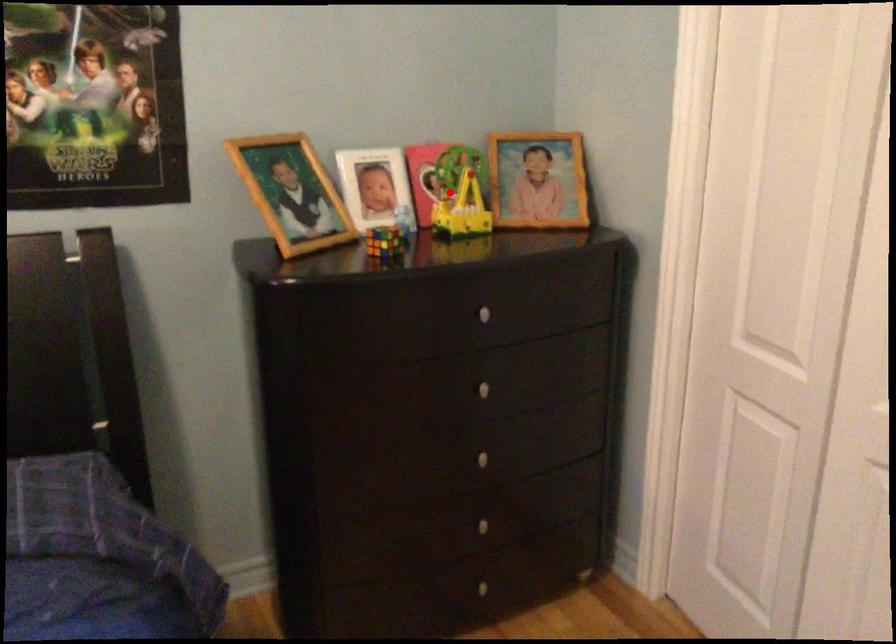
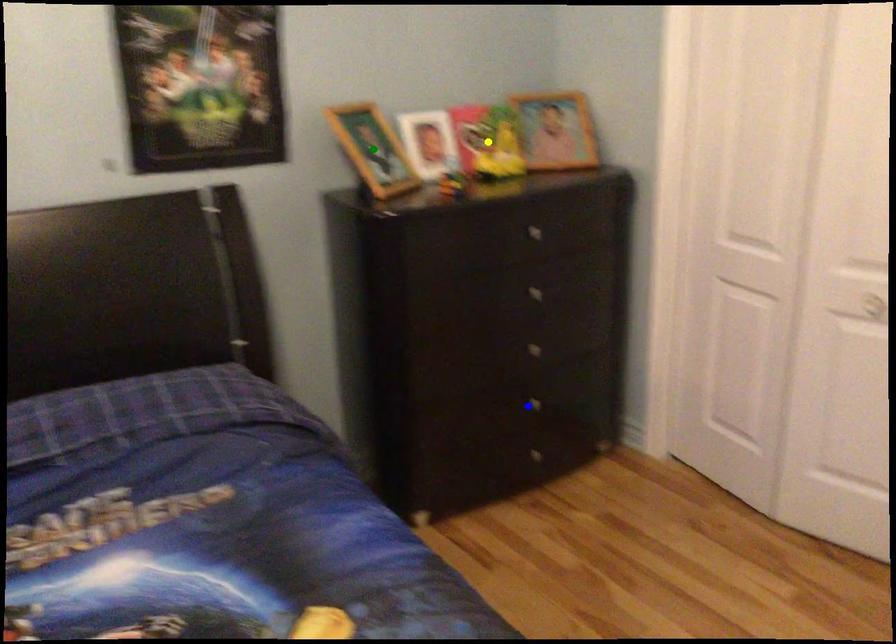
Question: I am providing you with two images of the same scene from different viewpoints. A red point is marked on the first image. You are given multiple points on the second image. Which spot in image 2 lines up with the point in image 1?

Choices:
 (A) blue point
 (B) green point
 (C) yellow point

Answer: (C)